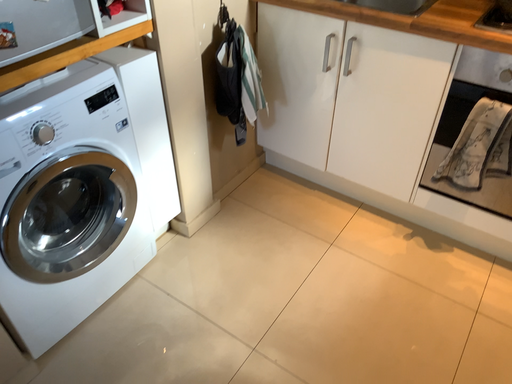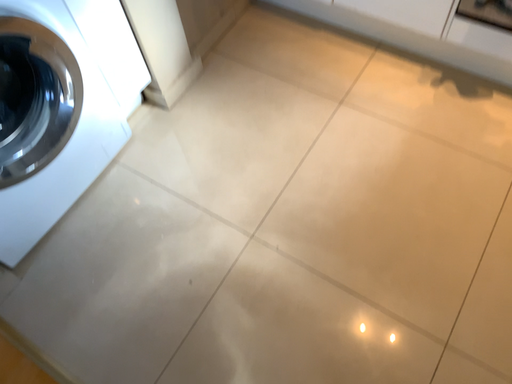
Question: How did the camera likely rotate when shooting the video?

Choices:
 (A) rotated upward
 (B) rotated downward

Answer: (B)